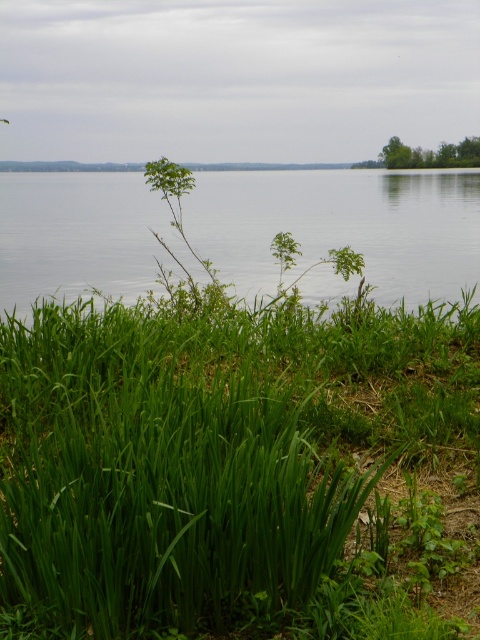
Question: Can you confirm if transparent water at center is positioned below green grass at upper right?

Choices:
 (A) no
 (B) yes

Answer: (B)

Question: Which point is closer to the camera?

Choices:
 (A) (406, 156)
 (B) (414, 244)

Answer: (B)

Question: Estimate the real-world distances between objects in this image. Which object is farther from the green leafy grass at lower left?

Choices:
 (A) transparent water at center
 (B) green grass at upper right

Answer: (B)

Question: Which point is farther from the camera taking this photo?

Choices:
 (A) (108, 216)
 (B) (396, 144)

Answer: (B)

Question: Does green leafy grass at lower left have a larger size compared to green grass at upper right?

Choices:
 (A) no
 (B) yes

Answer: (B)

Question: Does green leafy grass at lower left have a lesser width compared to green grass at upper right?

Choices:
 (A) yes
 (B) no

Answer: (B)